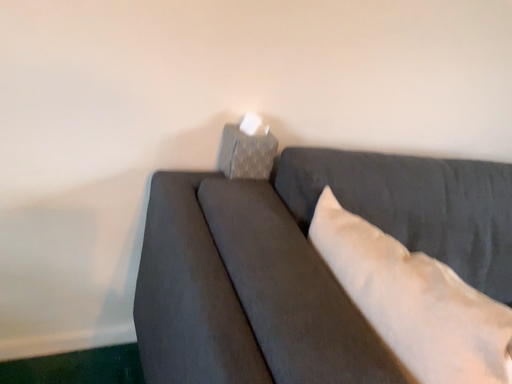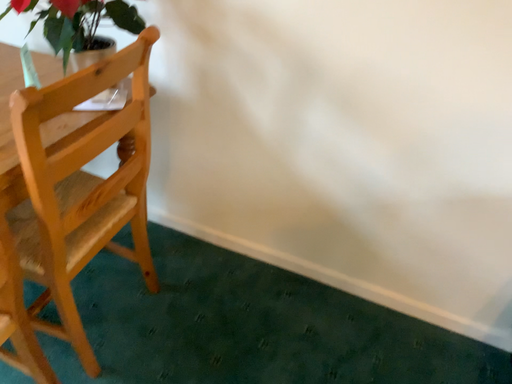
Question: Which way did the camera rotate in the video?

Choices:
 (A) rotated right
 (B) rotated left

Answer: (B)